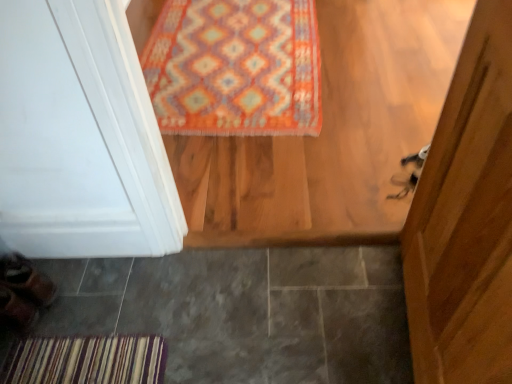
Question: Is the position of gray tile at lower left more distant than that of leather brown shoe at lower left, which is the second shoe from top to bottom?

Choices:
 (A) yes
 (B) no

Answer: (B)

Question: Considering the relative sizes of gray tile at lower left and leather brown shoe at lower left, which is the second shoe from top to bottom, in the image provided, is gray tile at lower left thinner than leather brown shoe at lower left, which is the second shoe from top to bottom,?

Choices:
 (A) yes
 (B) no

Answer: (B)

Question: Does gray tile at lower left have a smaller size compared to leather brown shoe at lower left, the 1th shoe ordered from the bottom?

Choices:
 (A) yes
 (B) no

Answer: (B)

Question: Can you confirm if gray tile at lower left is positioned to the left of leather brown shoe at lower left, which is the second shoe from top to bottom?

Choices:
 (A) yes
 (B) no

Answer: (B)

Question: From the image's perspective, does gray tile at lower left appear lower than leather brown shoe at lower left, which is the second shoe from top to bottom?

Choices:
 (A) yes
 (B) no

Answer: (A)

Question: Does gray tile at lower left have a larger size compared to leather brown shoe at lower left, the 1th shoe ordered from the bottom?

Choices:
 (A) no
 (B) yes

Answer: (B)

Question: From a real-world perspective, is multicolored woven rug at upper center on top of gray tile at lower left?

Choices:
 (A) yes
 (B) no

Answer: (A)

Question: Is multicolored woven rug at upper center oriented away from gray tile at lower left?

Choices:
 (A) no
 (B) yes

Answer: (A)

Question: Does multicolored woven rug at upper center appear on the left side of gray tile at lower left?

Choices:
 (A) no
 (B) yes

Answer: (A)

Question: Can you confirm if multicolored woven rug at upper center is bigger than gray tile at lower left?

Choices:
 (A) no
 (B) yes

Answer: (B)

Question: Is multicolored woven rug at upper center next to gray tile at lower left?

Choices:
 (A) no
 (B) yes

Answer: (A)

Question: Is multicolored woven rug at upper center positioned beyond the bounds of gray tile at lower left?

Choices:
 (A) no
 (B) yes

Answer: (B)

Question: Is leather brown shoe at lower left, the 1th shoe ordered from the bottom, bigger than gray tile at lower left?

Choices:
 (A) no
 (B) yes

Answer: (A)